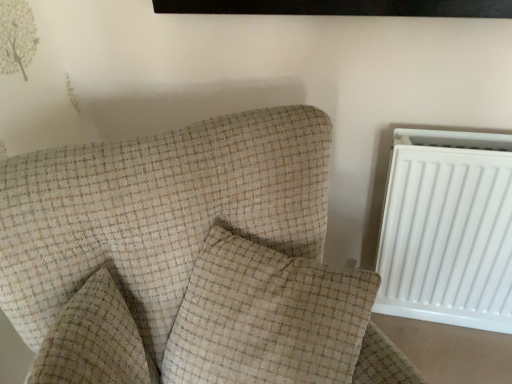
Measure the distance between point (x=47, y=368) and camera.

The depth of point (x=47, y=368) is 66.80 centimeters.

What do you see at coordinates (267, 318) in the screenshot? This screenshot has width=512, height=384. I see `beige textured pillow at center, which appears as the 1th pillow when viewed from the right` at bounding box center [267, 318].

I want to click on beige textured pillow at center, which appears as the 1th pillow when viewed from the right, so click(x=267, y=318).

The height and width of the screenshot is (384, 512). Find the location of `white plastic radiator at right`. white plastic radiator at right is located at coordinates (448, 229).

Is point (52, 382) in front of point (248, 120)?

Yes, it is.

Based on their positions, is beige checkered pillow at center, acting as the 2th pillow starting from the right, located to the left or right of beige checkered armchair at center-left?

beige checkered pillow at center, acting as the 2th pillow starting from the right, is to the left of beige checkered armchair at center-left.

Can we say beige checkered pillow at center, which is counted as the first pillow, starting from the left, lies outside beige checkered armchair at center-left?

No, most part of beige checkered pillow at center, which is counted as the first pillow, starting from the left, lies within beige checkered armchair at center-left.

Is beige checkered pillow at center, which is counted as the first pillow, starting from the left, aimed at beige checkered armchair at center-left?

Yes.

From their relative heights in the image, would you say white plastic radiator at right is taller or shorter than beige textured pillow at center, which appears as the 1th pillow when viewed from the right?

In the image, white plastic radiator at right appears to be taller than beige textured pillow at center, which appears as the 1th pillow when viewed from the right.

Considering the sizes of white plastic radiator at right and beige textured pillow at center, which appears as the 2th pillow when viewed from the left, in the image, is white plastic radiator at right wider or thinner than beige textured pillow at center, which appears as the 2th pillow when viewed from the left,?

In the image, white plastic radiator at right appears to be more narrow than beige textured pillow at center, which appears as the 2th pillow when viewed from the left.

From a real-world perspective, is white plastic radiator at right under beige textured pillow at center, which appears as the 2th pillow when viewed from the left?

Yes, from a real-world perspective, white plastic radiator at right is under beige textured pillow at center, which appears as the 2th pillow when viewed from the left.

From the white plastic radiator at right, count 1st pillows forward and point to it. Please provide its 2D coordinates.

[(94, 341)]

Based on the photo, is white plastic radiator at right with beige checkered pillow at center, acting as the 2th pillow starting from the right?

No, white plastic radiator at right is not making contact with beige checkered pillow at center, acting as the 2th pillow starting from the right.

Which is less distant, (x=383, y=297) or (x=148, y=358)?

Point (x=383, y=297) is farther from the camera than point (x=148, y=358).

Between white plastic radiator at right and beige checkered pillow at center, acting as the 2th pillow starting from the right, which one has larger size?

white plastic radiator at right.

This screenshot has height=384, width=512. Identify the location of the 1st pillow above the white plastic radiator at right (from a real-world perspective). (94, 341).

Can you confirm if beige checkered pillow at center, which is counted as the first pillow, starting from the left, is bigger than white plastic radiator at right?

Actually, beige checkered pillow at center, which is counted as the first pillow, starting from the left, might be smaller than white plastic radiator at right.

Considering the positions of objects beige checkered pillow at center, acting as the 2th pillow starting from the right, and white plastic radiator at right in the image provided, who is behind, beige checkered pillow at center, acting as the 2th pillow starting from the right, or white plastic radiator at right?

white plastic radiator at right is behind.

Between beige checkered armchair at center-left and beige textured pillow at center, which appears as the 1th pillow when viewed from the right, which one has more height?

With more height is beige checkered armchair at center-left.

Is beige checkered armchair at center-left further to the viewer compared to beige textured pillow at center, which appears as the 1th pillow when viewed from the right?

No, it is not.

How much distance is there between beige checkered armchair at center-left and beige textured pillow at center, which appears as the 1th pillow when viewed from the right?

beige checkered armchair at center-left is 2.94 inches away from beige textured pillow at center, which appears as the 1th pillow when viewed from the right.

Are beige checkered armchair at center-left and beige textured pillow at center, which appears as the 1th pillow when viewed from the right, located far from each other?

No, there isn't a large distance between beige checkered armchair at center-left and beige textured pillow at center, which appears as the 1th pillow when viewed from the right.

Between point (465, 169) and point (242, 173), which one is positioned behind?

The point (465, 169) is behind.

From a real-world perspective, is white plastic radiator at right physically below beige checkered armchair at center-left?

Yes, from a real-world perspective, white plastic radiator at right is beneath beige checkered armchair at center-left.

Does white plastic radiator at right appear on the left side of beige checkered armchair at center-left?

No.

Does white plastic radiator at right turn towards beige checkered armchair at center-left?

No, white plastic radiator at right is not facing towards beige checkered armchair at center-left.

Would you say beige checkered pillow at center, which is counted as the first pillow, starting from the left, is inside or outside beige textured pillow at center, which appears as the 2th pillow when viewed from the left?

beige checkered pillow at center, which is counted as the first pillow, starting from the left, exists outside the volume of beige textured pillow at center, which appears as the 2th pillow when viewed from the left.

Does beige checkered pillow at center, acting as the 2th pillow starting from the right, lie behind beige textured pillow at center, which appears as the 1th pillow when viewed from the right?

Yes.

The height and width of the screenshot is (384, 512). I want to click on pillow that appears above the beige checkered pillow at center, acting as the 2th pillow starting from the right (from the image's perspective), so click(x=267, y=318).

At what (x,y) coordinates should I click in order to perform the action: click on furniture below the beige checkered pillow at center, which is counted as the first pillow, starting from the left (from a real-world perspective). Please return your answer as a coordinate pair (x, y). Looking at the image, I should click on (187, 260).

The width and height of the screenshot is (512, 384). Identify the location of the 1st pillow below the white plastic radiator at right (from the image's perspective). (267, 318).

Based on their spatial positions, is white plastic radiator at right or beige textured pillow at center, which appears as the 2th pillow when viewed from the left, closer to beige checkered pillow at center, which is counted as the first pillow, starting from the left?

Among the two, beige textured pillow at center, which appears as the 2th pillow when viewed from the left, is located nearer to beige checkered pillow at center, which is counted as the first pillow, starting from the left.

Estimate the real-world distances between objects in this image. Which object is closer to beige checkered armchair at center-left, white plastic radiator at right or beige textured pillow at center, which appears as the 1th pillow when viewed from the right?

Among the two, beige textured pillow at center, which appears as the 1th pillow when viewed from the right, is located nearer to beige checkered armchair at center-left.

From the image, which object appears to be farther from beige textured pillow at center, which appears as the 1th pillow when viewed from the right, beige checkered pillow at center, which is counted as the first pillow, starting from the left, or beige checkered armchair at center-left?

beige checkered pillow at center, which is counted as the first pillow, starting from the left, is positioned further to the anchor beige textured pillow at center, which appears as the 1th pillow when viewed from the right.

Based on their spatial positions, is white plastic radiator at right or beige checkered pillow at center, which is counted as the first pillow, starting from the left, further from beige checkered armchair at center-left?

The object further to beige checkered armchair at center-left is white plastic radiator at right.

Considering their positions, is white plastic radiator at right positioned further to beige checkered pillow at center, which is counted as the first pillow, starting from the left, than beige checkered armchair at center-left?

The object further to beige checkered pillow at center, which is counted as the first pillow, starting from the left, is white plastic radiator at right.

Looking at the image, which one is located further to white plastic radiator at right, beige checkered armchair at center-left or beige checkered pillow at center, which is counted as the first pillow, starting from the left?

Based on the image, beige checkered pillow at center, which is counted as the first pillow, starting from the left, appears to be further to white plastic radiator at right.

Looking at the image, which one is located further to white plastic radiator at right, beige textured pillow at center, which appears as the 1th pillow when viewed from the right, or beige checkered pillow at center, which is counted as the first pillow, starting from the left?

Based on the image, beige checkered pillow at center, which is counted as the first pillow, starting from the left, appears to be further to white plastic radiator at right.

Which object lies further to the anchor point beige checkered pillow at center, which is counted as the first pillow, starting from the left, beige textured pillow at center, which appears as the 2th pillow when viewed from the left, or beige checkered armchair at center-left?

beige textured pillow at center, which appears as the 2th pillow when viewed from the left, is further to beige checkered pillow at center, which is counted as the first pillow, starting from the left.

The width and height of the screenshot is (512, 384). I want to click on pillow situated between beige checkered armchair at center-left and white plastic radiator at right from left to right, so click(267, 318).

You are a GUI agent. You are given a task and a screenshot of the screen. Output one action in this format:
    pyautogui.click(x=<x>, y=<y>)
    Task: Click on the pillow located between beige checkered armchair at center-left and beige checkered pillow at center, which is counted as the first pillow, starting from the left, in the depth direction
    This screenshot has height=384, width=512.
    Given the screenshot: What is the action you would take?
    pyautogui.click(x=267, y=318)

I want to click on pillow located between beige checkered pillow at center, acting as the 2th pillow starting from the right, and white plastic radiator at right in the left-right direction, so click(x=267, y=318).

Where is `furniture situated between beige checkered pillow at center, acting as the 2th pillow starting from the right, and white plastic radiator at right from left to right`? This screenshot has height=384, width=512. furniture situated between beige checkered pillow at center, acting as the 2th pillow starting from the right, and white plastic radiator at right from left to right is located at coordinates (187, 260).